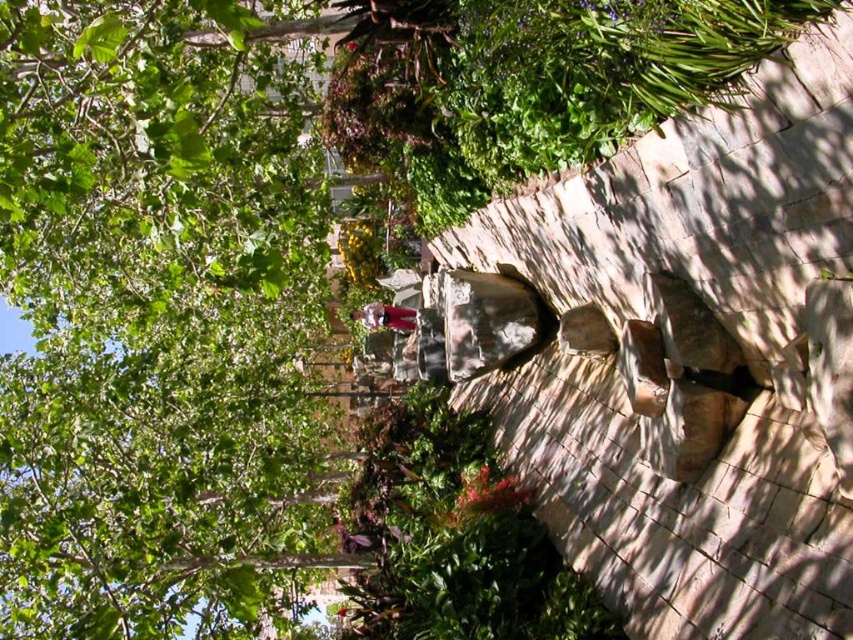
Question: Which object appears farthest from the camera in this image?

Choices:
 (A) natural stone rock face at center
 (B) green leafy tree at upper left

Answer: (B)

Question: Is green leafy tree at upper left wider than matte purple dress at center?

Choices:
 (A) no
 (B) yes

Answer: (B)

Question: Can you confirm if green leafy tree at upper left is positioned below matte purple dress at center?

Choices:
 (A) no
 (B) yes

Answer: (A)

Question: Among these objects, which one is farthest from the camera?

Choices:
 (A) matte purple dress at center
 (B) natural stone rock face at center
 (C) green leafy tree at upper left

Answer: (A)

Question: Based on their relative distances, which object is farther from the natural stone rock face at center?

Choices:
 (A) matte purple dress at center
 (B) green leafy tree at upper left

Answer: (A)

Question: Can you confirm if green leafy tree at upper left is smaller than natural stone rock face at center?

Choices:
 (A) yes
 (B) no

Answer: (B)